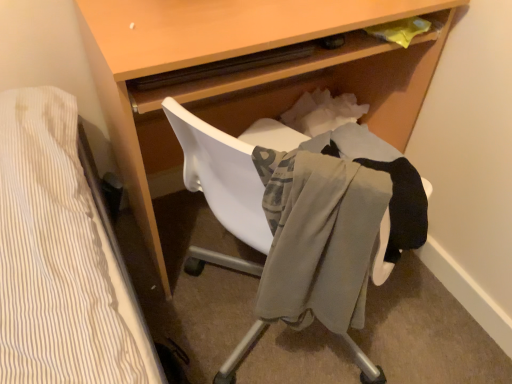
Question: Is light gray fabric at center bigger or smaller than light brown wood desk at center?

Choices:
 (A) small
 (B) big

Answer: (A)

Question: Is point (372, 165) positioned closer to the camera than point (154, 124)?

Choices:
 (A) farther
 (B) closer

Answer: (B)

Question: From their relative heights in the image, would you say light gray fabric at center is taller or shorter than light brown wood desk at center?

Choices:
 (A) tall
 (B) short

Answer: (B)

Question: In terms of width, does light brown wood desk at center look wider or thinner when compared to light gray fabric at center?

Choices:
 (A) wide
 (B) thin

Answer: (A)

Question: From a real-world perspective, is light brown wood desk at center physically located above or below light gray fabric at center?

Choices:
 (A) below
 (B) above

Answer: (A)

Question: Based on their sizes in the image, would you say light brown wood desk at center is bigger or smaller than light gray fabric at center?

Choices:
 (A) big
 (B) small

Answer: (A)

Question: Is light brown wood desk at center taller or shorter than light gray fabric at center?

Choices:
 (A) tall
 (B) short

Answer: (A)